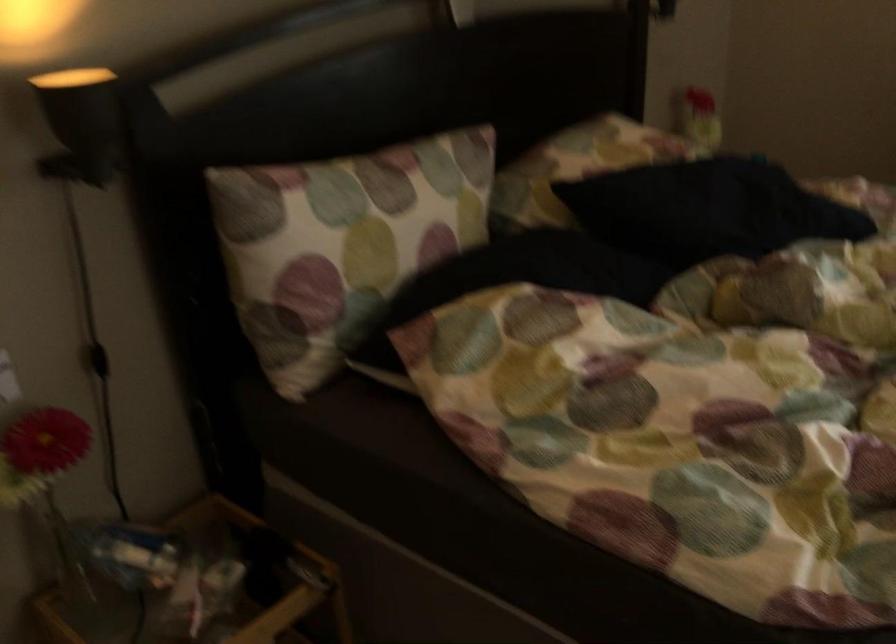
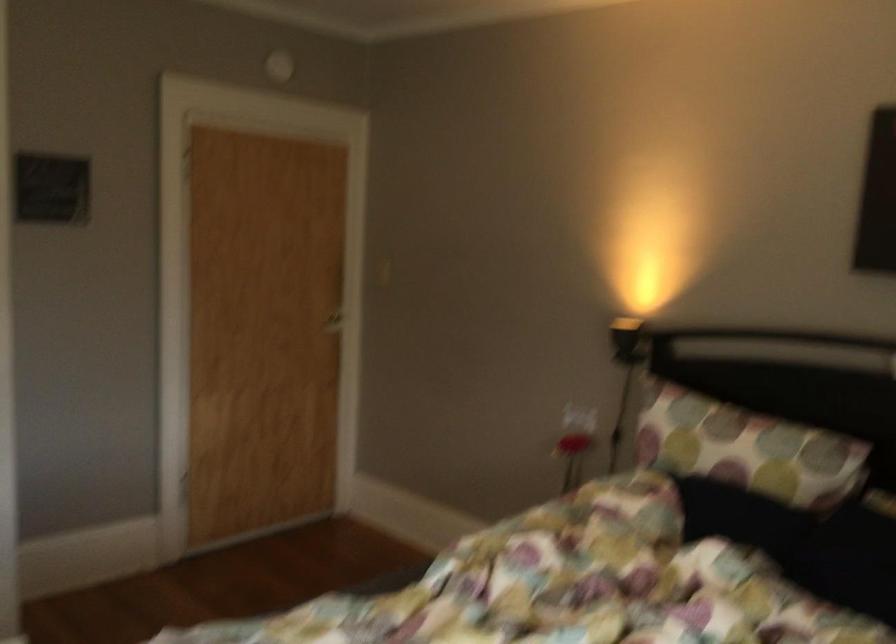
Where in the second image is the point corresponding to (426,202) from the first image?

(746, 449)